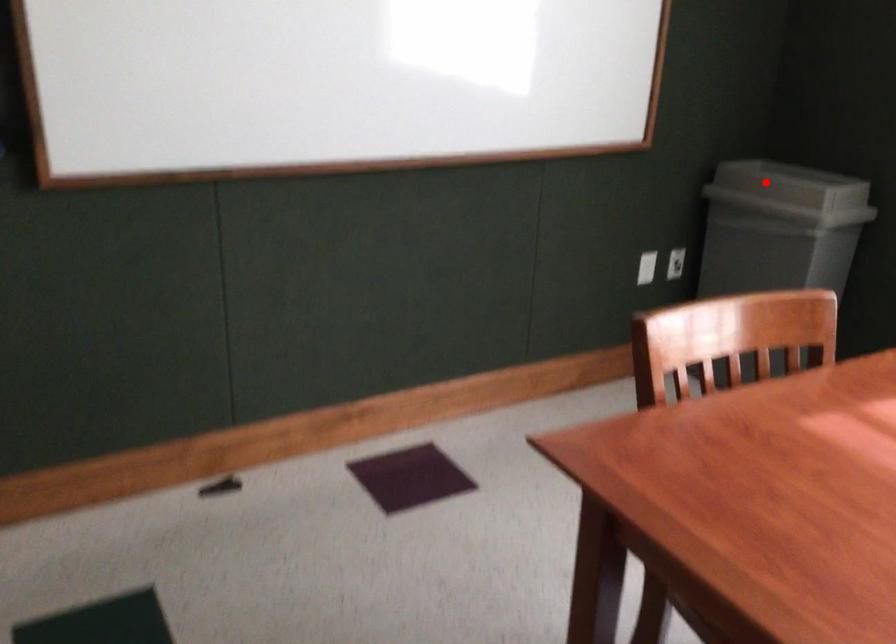
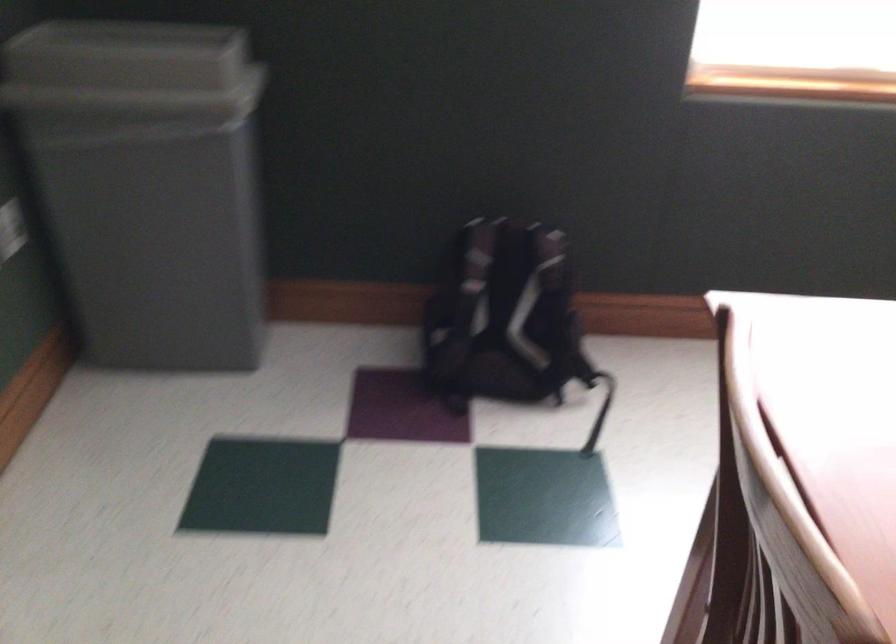
Question: I am providing you with two images of the same scene from different viewpoints. In image1, a red point is highlighted. Considering the same 3D point in image2, which of the following is correct?

Choices:
 (A) It is closer
 (B) It is farther

Answer: (A)